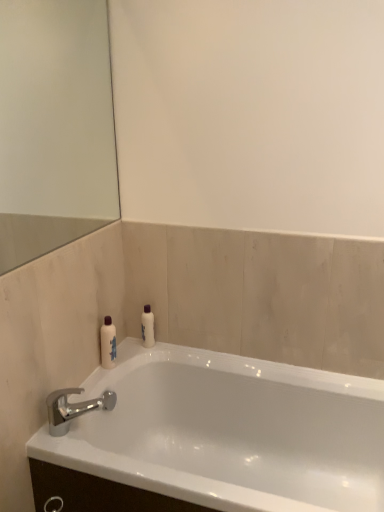
Question: Considering the positions of white glossy bottle at left, which appears as the 1th toiletry when viewed from the front, and white glossy bathtub at lower left in the image, is white glossy bottle at left, which appears as the 1th toiletry when viewed from the front, bigger or smaller than white glossy bathtub at lower left?

Choices:
 (A) small
 (B) big

Answer: (A)

Question: Is white glossy bottle at left, the 2th toiletry when ordered from right to left, in front of or behind white glossy bathtub at lower left in the image?

Choices:
 (A) behind
 (B) front

Answer: (A)

Question: Based on their relative distances, which object is farther from the chrome metallic faucet at lower left?

Choices:
 (A) white glossy bottle at upper center, the first toiletry positioned from the back
 (B) white glossy bottle at left, which appears as the 1th toiletry when viewed from the front
 (C) white glossy bathtub at lower left

Answer: (A)

Question: Estimate the real-world distances between objects in this image. Which object is farther from the white glossy bathtub at lower left?

Choices:
 (A) white glossy bottle at upper center, arranged as the 2th toiletry when viewed from the front
 (B) chrome metallic faucet at lower left
 (C) white glossy bottle at left, the first toiletry in the left-to-right sequence

Answer: (A)